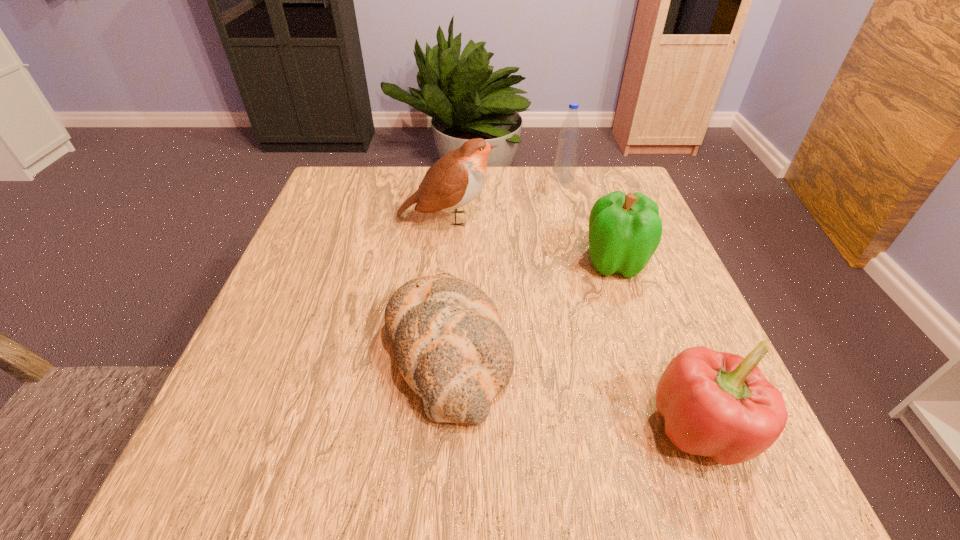
Locate an element on the screen. This screenshot has height=540, width=960. vacant area between the nearer bell pepper and the third nearest object is located at coordinates (658, 346).

Where is `blank region between the farthest object and the fourth nearest object`? blank region between the farthest object and the fourth nearest object is located at coordinates (505, 198).

Where is `empty space between the water bottle and the bird`? The height and width of the screenshot is (540, 960). empty space between the water bottle and the bird is located at coordinates (505, 198).

This screenshot has width=960, height=540. I want to click on unoccupied area between the third nearest object and the nearer bell pepper, so click(658, 346).

Locate an element on the screen. This screenshot has height=540, width=960. blank region between the shortest object and the water bottle is located at coordinates (506, 264).

Locate an element on the screen. free space that is in between the farthest object and the shortest object is located at coordinates pos(506,264).

Image resolution: width=960 pixels, height=540 pixels. In order to click on empty space between the farthest object and the nearer bell pepper in this screenshot , I will do `click(633, 303)`.

The image size is (960, 540). What are the coordinates of `empty location between the nearer bell pepper and the farthest object` in the screenshot? It's located at (633, 303).

This screenshot has width=960, height=540. Identify the location of empty location between the shortest object and the nearer bell pepper. (574, 390).

You are a GUI agent. You are given a task and a screenshot of the screen. Output one action in this format:
    pyautogui.click(x=<x>, y=<y>)
    Task: Click on the free spot between the bird and the third farthest object
    This screenshot has width=960, height=540.
    Given the screenshot: What is the action you would take?
    pyautogui.click(x=531, y=240)